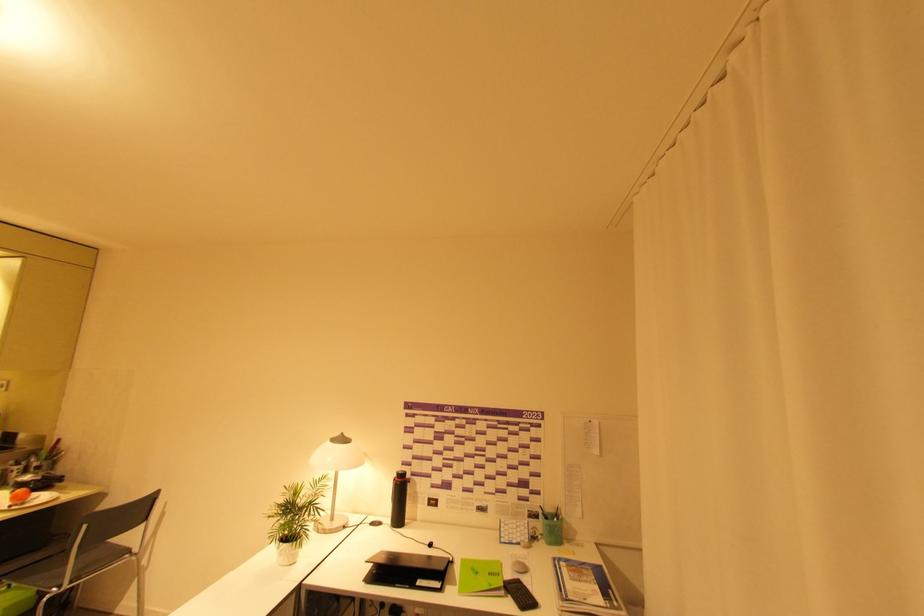
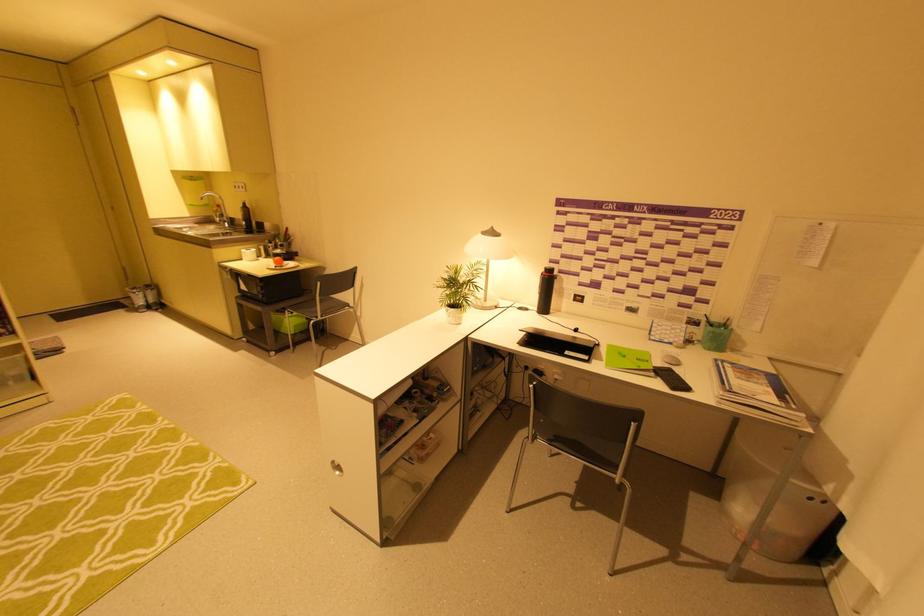
Where in the second image is the point corresponding to point (523, 582) from the first image?

(675, 371)